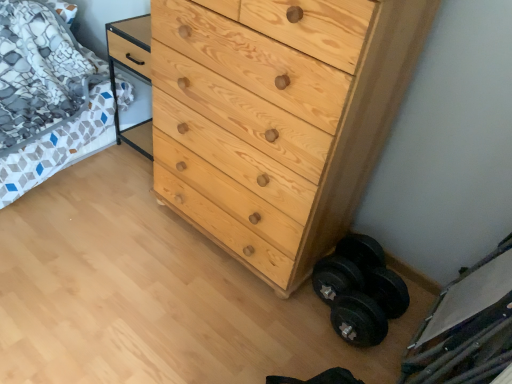
Question: From the image's perspective, is natural wood chest of drawers at center above patterned fabric bed at left?

Choices:
 (A) no
 (B) yes

Answer: (A)

Question: Does natural wood chest of drawers at center contain patterned fabric bed at left?

Choices:
 (A) yes
 (B) no

Answer: (B)

Question: Is natural wood chest of drawers at center far from patterned fabric bed at left?

Choices:
 (A) yes
 (B) no

Answer: (B)

Question: Does natural wood chest of drawers at center have a greater width compared to patterned fabric bed at left?

Choices:
 (A) yes
 (B) no

Answer: (B)

Question: Is natural wood chest of drawers at center located outside patterned fabric bed at left?

Choices:
 (A) no
 (B) yes

Answer: (B)

Question: From the image's perspective, is black rubber dumbbell at lower right above or below natural wood chest of drawers at center?

Choices:
 (A) below
 (B) above

Answer: (A)

Question: Choose the correct answer: Is black rubber dumbbell at lower right inside natural wood chest of drawers at center or outside it?

Choices:
 (A) inside
 (B) outside

Answer: (B)

Question: Considering the positions of black rubber dumbbell at lower right and natural wood chest of drawers at center in the image, is black rubber dumbbell at lower right wider or thinner than natural wood chest of drawers at center?

Choices:
 (A) thin
 (B) wide

Answer: (A)

Question: From their relative heights in the image, would you say black rubber dumbbell at lower right is taller or shorter than natural wood chest of drawers at center?

Choices:
 (A) tall
 (B) short

Answer: (B)

Question: Looking at the image, does patterned fabric bed at left seem bigger or smaller compared to black rubber dumbbell at lower right?

Choices:
 (A) big
 (B) small

Answer: (A)

Question: Is patterned fabric bed at left taller or shorter than black rubber dumbbell at lower right?

Choices:
 (A) tall
 (B) short

Answer: (A)

Question: Is point (27, 21) positioned closer to the camera than point (322, 261)?

Choices:
 (A) closer
 (B) farther

Answer: (B)

Question: In the image, is patterned fabric bed at left positioned in front of or behind black rubber dumbbell at lower right?

Choices:
 (A) front
 (B) behind

Answer: (B)

Question: In terms of size, does natural wood chest of drawers at center appear bigger or smaller than black rubber dumbbell at lower right?

Choices:
 (A) small
 (B) big

Answer: (B)

Question: Looking at their shapes, would you say natural wood chest of drawers at center is wider or thinner than black rubber dumbbell at lower right?

Choices:
 (A) wide
 (B) thin

Answer: (A)